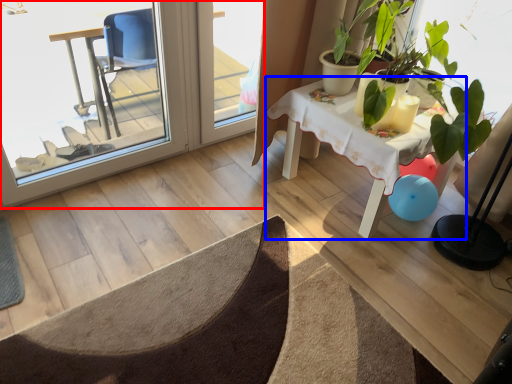
Question: Which object appears farthest to the camera in this image, screen door (highlighted by a red box) or table (highlighted by a blue box)?

Choices:
 (A) screen door
 (B) table

Answer: (B)